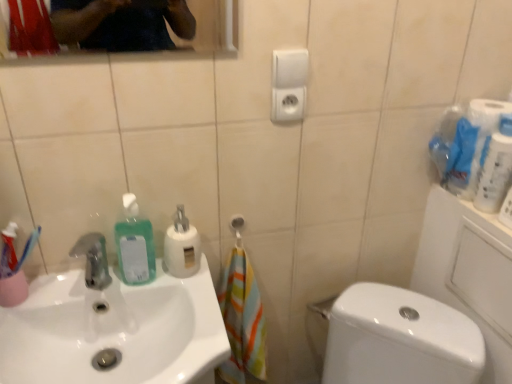
Where is `vacant area that lies to the right of green translucent liquid at sink left, arranged as the first cleaning product when viewed from the left`? vacant area that lies to the right of green translucent liquid at sink left, arranged as the first cleaning product when viewed from the left is located at coordinates click(x=185, y=291).